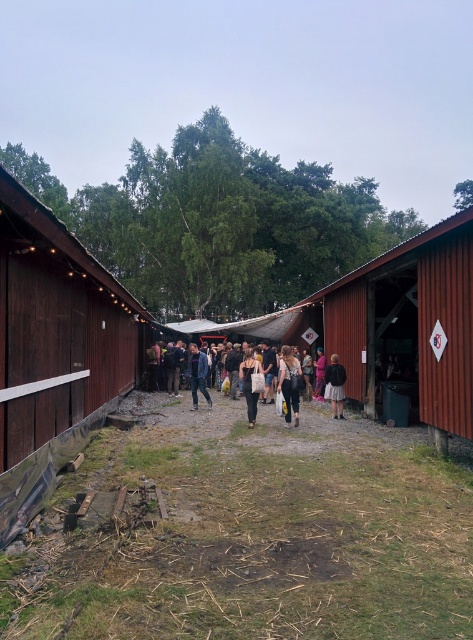
You are a photographer standing at the fairground. You notice a person wearing denim pants at center and carrying a matte black bag at center. Which item is taller when viewed from your perspective?

The denim pants at center has a greater height compared to the matte black bag at center, so the denim pants at center is taller.

You are a photographer trying to capture a candid shot of the denim pants at center and the matte black backpack at center in the fairground scene. Since you want to ensure both are clearly visible in your frame, which object should you focus on first considering their heights?

The denim pants at center has a greater height compared to the matte black backpack at center. Therefore, you should focus on the denim pants at center first as it is taller and will require more attention to capture its full detail while ensuring the matte black backpack at center remains in the same focal plane.

You are a gardener trying to plant a row of flowers between the brushed wood barn at left and the red corrugated metal barn at center. Which barn should you start closer to if you want the flowers to be evenly spaced between both?

You should start closer to the brushed wood barn at left because it is thinner than the red corrugated metal barn at center, so the spacing can be adjusted to ensure even distribution between both structures.